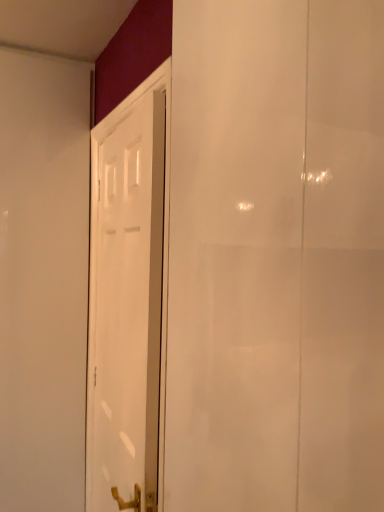
Question: Is transparent glass screen door at center taller than white glossy door at center?

Choices:
 (A) no
 (B) yes

Answer: (A)

Question: Is transparent glass screen door at center far from white glossy door at center?

Choices:
 (A) no
 (B) yes

Answer: (A)

Question: Considering the relative positions of transparent glass screen door at center and white glossy door at center in the image provided, is transparent glass screen door at center to the right of white glossy door at center from the viewer's perspective?

Choices:
 (A) no
 (B) yes

Answer: (B)

Question: Considering the relative sizes of transparent glass screen door at center and white glossy door at center in the image provided, is transparent glass screen door at center smaller than white glossy door at center?

Choices:
 (A) yes
 (B) no

Answer: (B)

Question: From a real-world perspective, is transparent glass screen door at center physically above white glossy door at center?

Choices:
 (A) no
 (B) yes

Answer: (B)

Question: Can white glossy door at center be found inside transparent glass screen door at center?

Choices:
 (A) yes
 (B) no

Answer: (B)

Question: From the image's perspective, would you say white glossy door at center is shown under transparent glass screen door at center?

Choices:
 (A) no
 (B) yes

Answer: (B)

Question: Does white glossy door at center have a lesser width compared to transparent glass screen door at center?

Choices:
 (A) no
 (B) yes

Answer: (B)

Question: Would you say white glossy door at center contains transparent glass screen door at center?

Choices:
 (A) yes
 (B) no

Answer: (B)

Question: Is white glossy door at center bigger than transparent glass screen door at center?

Choices:
 (A) no
 (B) yes

Answer: (A)

Question: Could you tell me if white glossy door at center is turned towards transparent glass screen door at center?

Choices:
 (A) no
 (B) yes

Answer: (A)

Question: Considering the relative sizes of white glossy door at center and transparent glass screen door at center in the image provided, is white glossy door at center smaller than transparent glass screen door at center?

Choices:
 (A) yes
 (B) no

Answer: (A)

Question: From a real-world perspective, relative to white glossy door at center, is transparent glass screen door at center vertically above or below?

Choices:
 (A) below
 (B) above

Answer: (B)